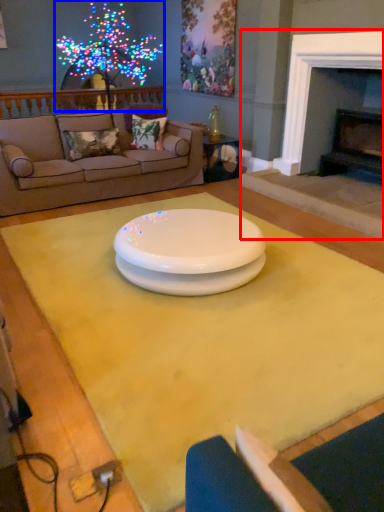
Question: Among these objects, which one is nearest to the camera, fireplace (highlighted by a red box) or christmas decoration (highlighted by a blue box)?

Choices:
 (A) fireplace
 (B) christmas decoration

Answer: (A)